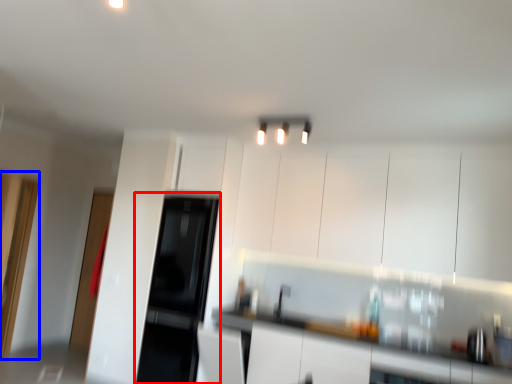
Question: Which of the following is the farthest to the observer, appliance (highlighted by a red box) or glass door (highlighted by a blue box)?

Choices:
 (A) appliance
 (B) glass door

Answer: (A)